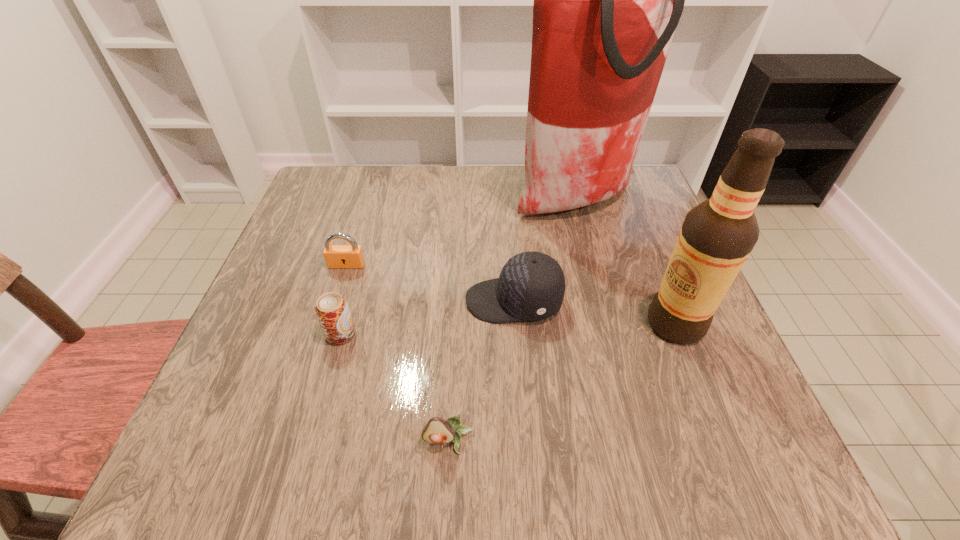
The image size is (960, 540). Identify the location of free spot between the baseball cap and the alcohol. click(594, 312).

The height and width of the screenshot is (540, 960). In order to click on vacant space in between the alcohol and the grocery bag in this screenshot , I will do `click(626, 263)`.

Find the location of a particular element. blank region between the fifth shortest object and the farthest object is located at coordinates (626, 263).

What are the coordinates of `vacant area between the beer can and the farthest object` in the screenshot? It's located at (459, 268).

Where is `empty space between the fifth nearest object and the avocado`? empty space between the fifth nearest object and the avocado is located at coordinates (397, 353).

The height and width of the screenshot is (540, 960). Identify the location of free area in between the baseball cap and the avocado. (481, 371).

Locate an element on the screen. This screenshot has height=540, width=960. vacant area that lies between the alcohol and the fourth shortest object is located at coordinates (594, 312).

This screenshot has height=540, width=960. What are the coordinates of `empty space that is in between the padlock and the grocery bag` in the screenshot? It's located at (462, 233).

This screenshot has width=960, height=540. I want to click on unoccupied position between the farthest object and the baseball cap, so click(545, 251).

Point out which object is positioned as the fourth nearest to the farthest object. Please provide its 2D coordinates. Your answer should be formatted as a tuple, i.e. [(x, y)], where the tuple contains the x and y coordinates of a point satisfying the conditions above.

[(332, 311)]